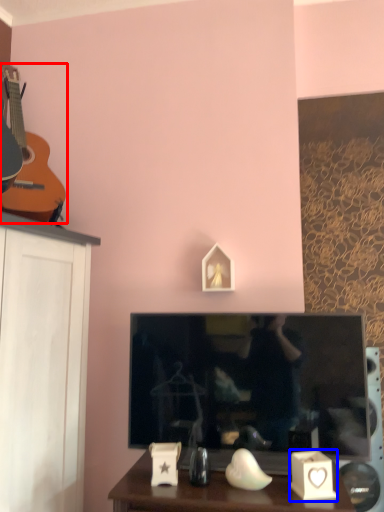
Question: Among these objects, which one is nearest to the camera, guitar (highlighted by a red box) or candle holder (highlighted by a blue box)?

Choices:
 (A) guitar
 (B) candle holder

Answer: (B)